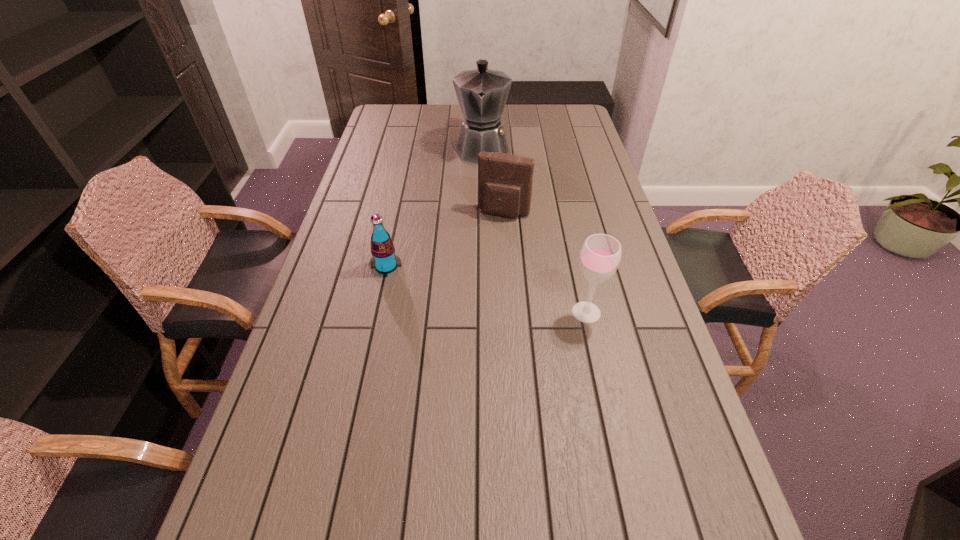
Locate an element on the screen. free spot on the desktop that is between the leftmost object and the wineglass and is positioned at the spout of the coffeepot is located at coordinates (476, 287).

What are the coordinates of `vacant space on the desktop that is between the leftmost object and the wineglass and is positioned with an open flap on the pouch` in the screenshot? It's located at (475, 287).